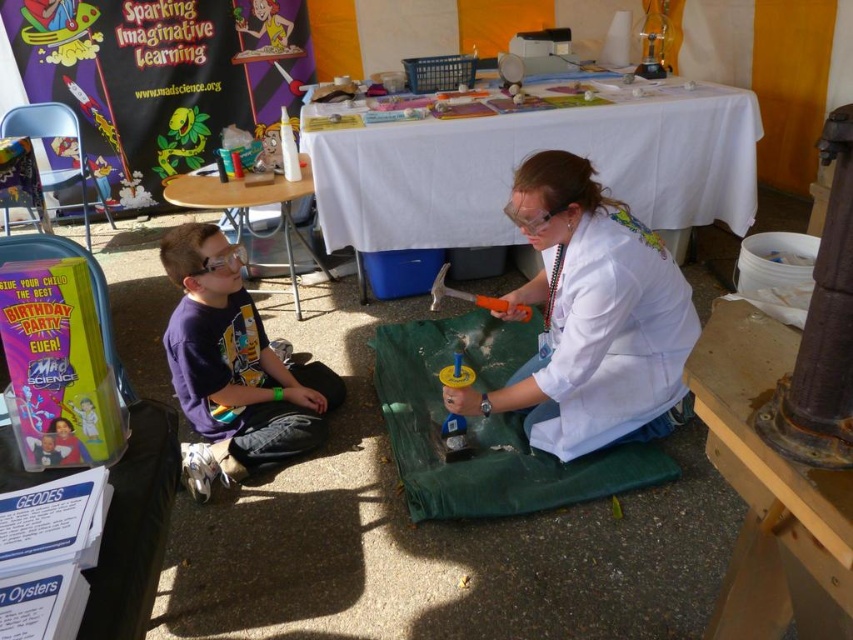
You are standing at point (456,385) and want to walk to point (334,154). Which direction should you move in relative to the geode being broken open by the woman?

You should move behind the woman and the geode being broken open because point (334,154) is behind point (456,385).